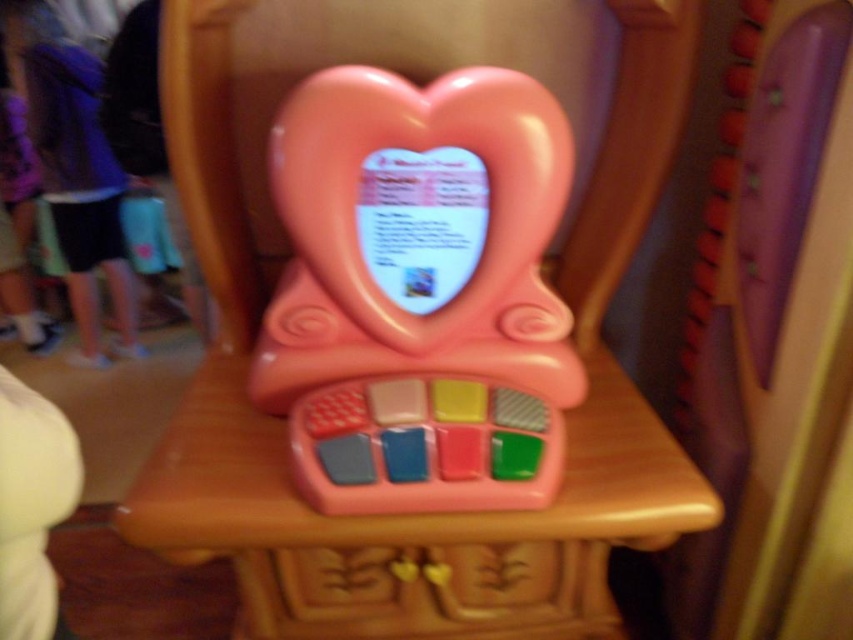
Question: Considering the relative positions of pink plastic chair at center and pink plastic toy at center in the image provided, where is pink plastic chair at center located with respect to pink plastic toy at center?

Choices:
 (A) below
 (B) above

Answer: (A)

Question: Is pink plastic chair at center smaller than pink plastic toy at center?

Choices:
 (A) yes
 (B) no

Answer: (B)

Question: Does pink plastic chair at center appear over pink plastic toy at center?

Choices:
 (A) no
 (B) yes

Answer: (A)